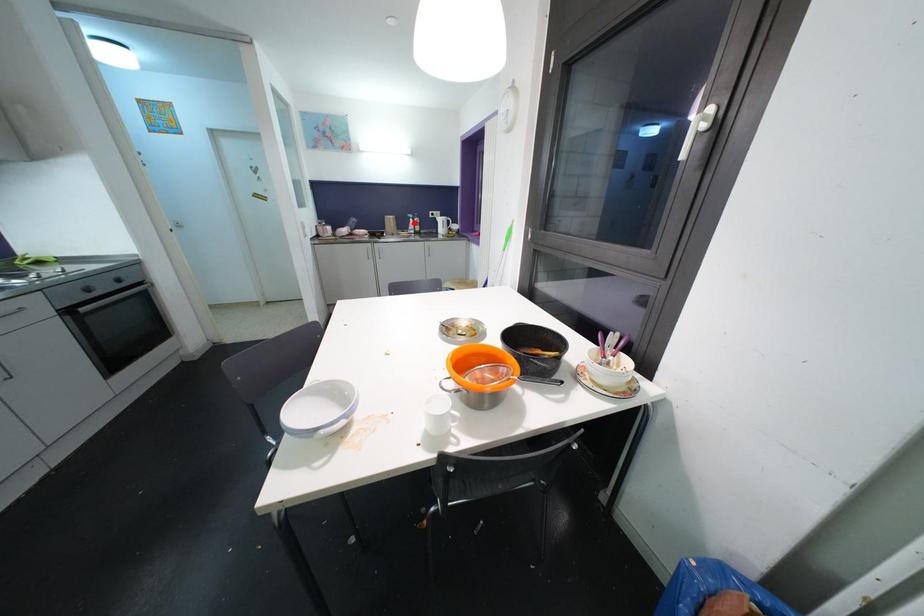
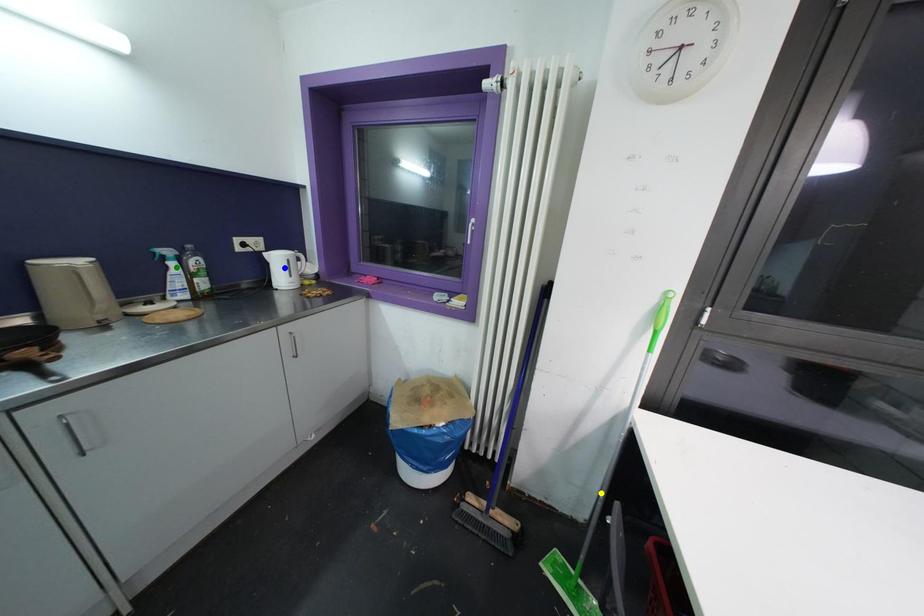
Question: I am providing you with two images of the same scene from different viewpoints. A red point is marked on the first image. You are given multiple points on the second image. Which spot in image 2 lines up with the point in image 1?

Choices:
 (A) yellow point
 (B) blue point
 (C) green point

Answer: (C)